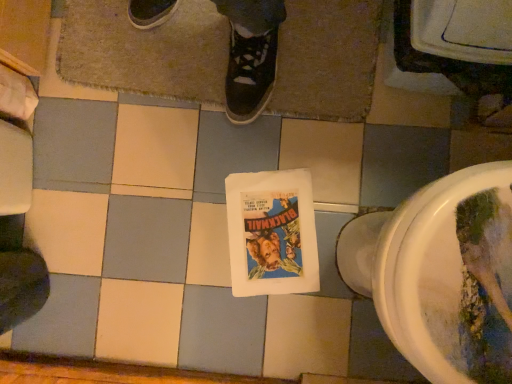
This screenshot has width=512, height=384. Identify the location of spots to the right of matte paper comic book at center. [x=327, y=197].